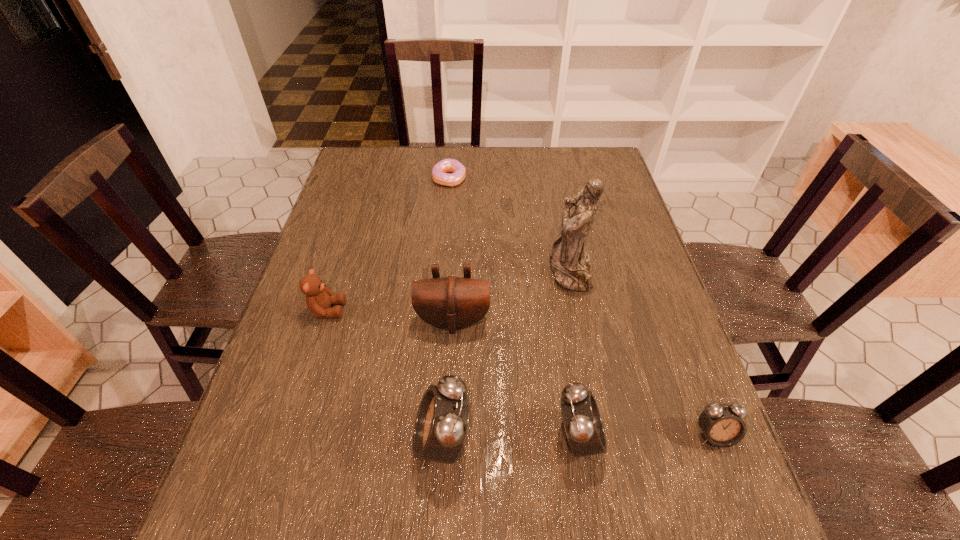
Where is `object that is positioned at the far edge`? Image resolution: width=960 pixels, height=540 pixels. object that is positioned at the far edge is located at coordinates (440, 173).

Where is `object present at the left edge`? object present at the left edge is located at coordinates (318, 298).

Where is `object that is at the right edge`? object that is at the right edge is located at coordinates (722, 425).

What are the coordinates of `object located at the near right corner` in the screenshot? It's located at (722, 425).

Locate an element on the screen. The height and width of the screenshot is (540, 960). vacant space at the far edge of the desktop is located at coordinates (564, 170).

This screenshot has width=960, height=540. Find the location of `free spot at the left edge of the desktop`. free spot at the left edge of the desktop is located at coordinates (364, 260).

Locate an element on the screen. Image resolution: width=960 pixels, height=540 pixels. free location at the right edge is located at coordinates (588, 245).

Identify the location of vacant space at the far right corner of the desktop. This screenshot has width=960, height=540. (617, 173).

Locate an element on the screen. vacant space that is in between the rightmost alarm clock and the leftmost object is located at coordinates (520, 373).

Identify the location of free spot between the pouch and the doughnut. (451, 249).